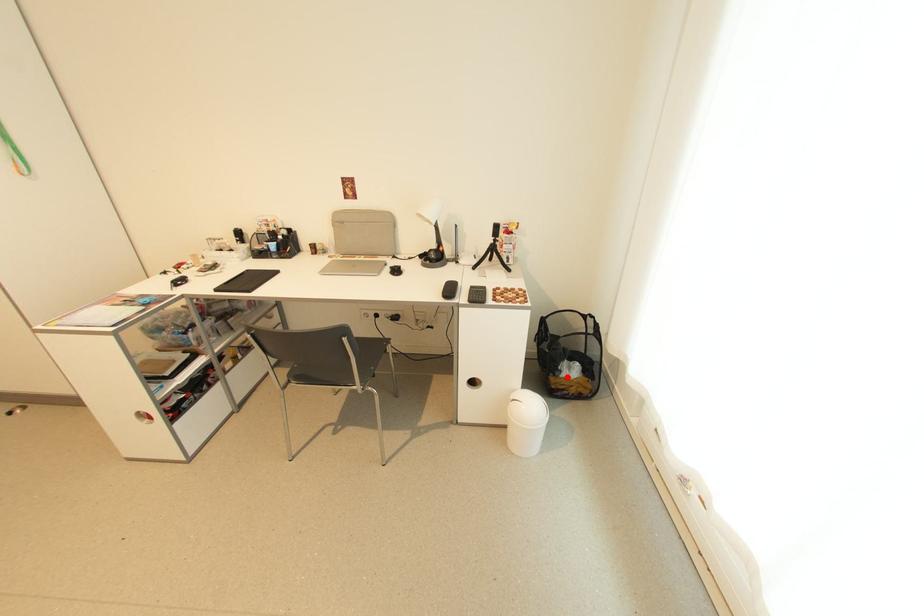
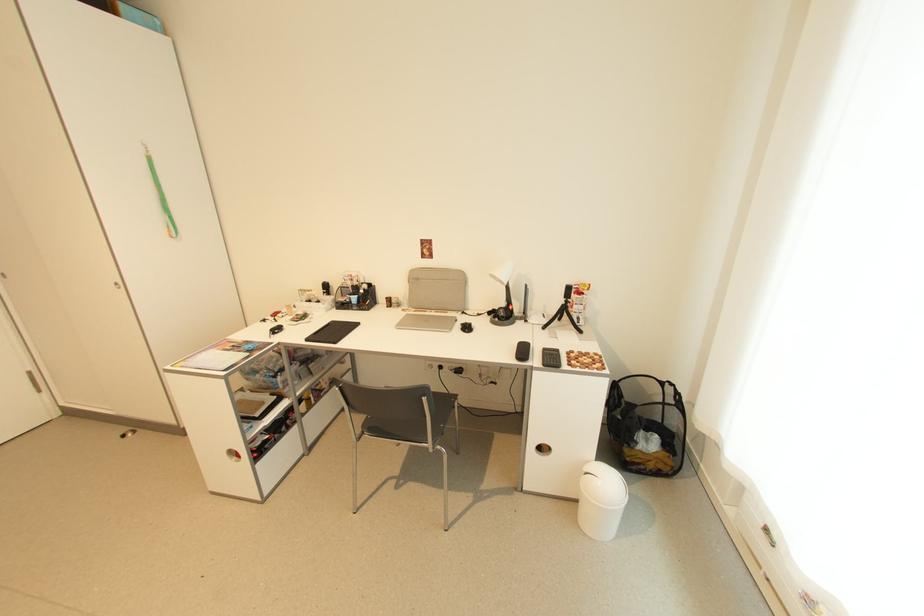
In the second image, find the point that corresponds to the highlighted location in the first image.

(642, 450)